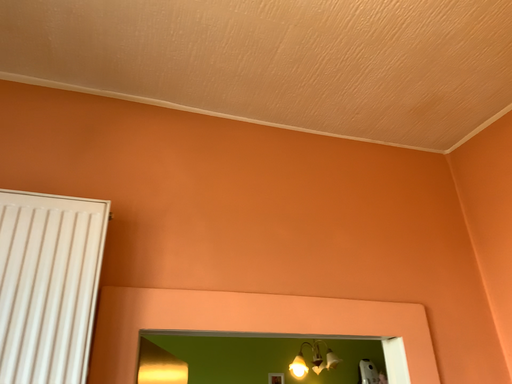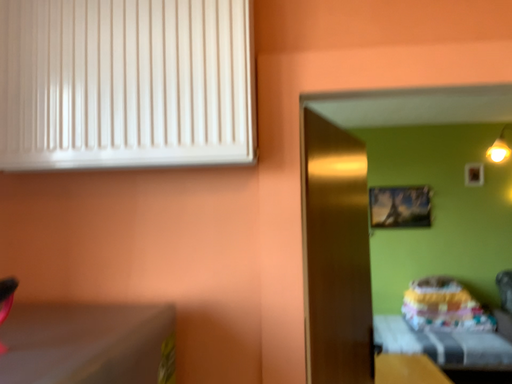
Question: Which way did the camera rotate in the video?

Choices:
 (A) rotated left
 (B) rotated right

Answer: (A)